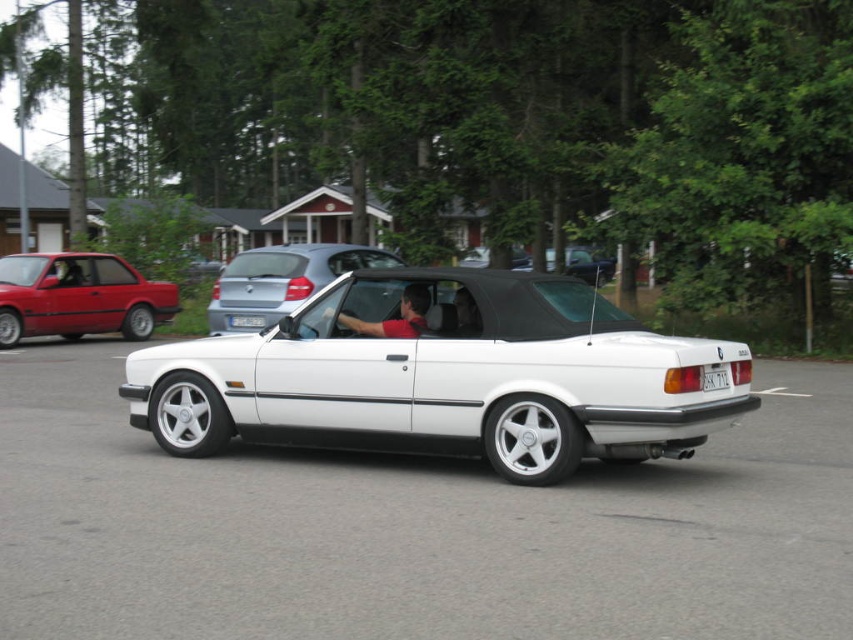
Question: Based on their relative distances, which object is farther from the white metallic convertible at center?

Choices:
 (A) matte black convertible at center
 (B) matte red sedan at left
 (C) red plastic license plate at center
 (D) white metallic car at center

Answer: (A)

Question: Which object is the farthest from the matte black convertible at center?

Choices:
 (A) white metallic car at center
 (B) white matte convertible at center
 (C) red plastic license plate at center
 (D) white plastic license plate at center

Answer: (A)

Question: Where is white metallic car at center located in relation to white glossy convertible at center in the image?

Choices:
 (A) left
 (B) right

Answer: (B)

Question: Does white matte convertible at center appear under white metallic convertible at center?

Choices:
 (A) no
 (B) yes

Answer: (B)

Question: Which of the following is the farthest from the observer?

Choices:
 (A) matte red sedan at left
 (B) red smooth shirt at center

Answer: (A)

Question: Is matte black convertible at center positioned at the back of white metallic convertible at center?

Choices:
 (A) yes
 (B) no

Answer: (A)